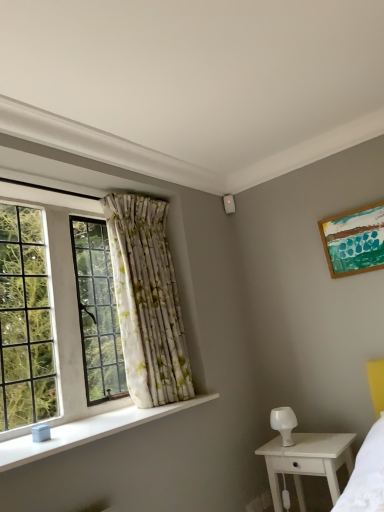
Question: Considering the relative sizes of white wood nightstand at lower right and white smooth window sill at lower left in the image provided, is white wood nightstand at lower right wider than white smooth window sill at lower left?

Choices:
 (A) no
 (B) yes

Answer: (B)

Question: Considering the relative positions of white wood nightstand at lower right and white smooth window sill at lower left in the image provided, is white wood nightstand at lower right behind white smooth window sill at lower left?

Choices:
 (A) yes
 (B) no

Answer: (A)

Question: Is white wood nightstand at lower right not within white smooth window sill at lower left?

Choices:
 (A) yes
 (B) no

Answer: (A)

Question: Does white wood nightstand at lower right have a lesser width compared to white smooth window sill at lower left?

Choices:
 (A) no
 (B) yes

Answer: (A)

Question: Is white wood nightstand at lower right oriented towards white smooth window sill at lower left?

Choices:
 (A) no
 (B) yes

Answer: (A)

Question: Is white glossy lamp at lower right inside the boundaries of white floral fabric curtain at left, or outside?

Choices:
 (A) inside
 (B) outside

Answer: (B)

Question: From a real-world perspective, is white glossy lamp at lower right physically located above or below white floral fabric curtain at left?

Choices:
 (A) below
 (B) above

Answer: (A)

Question: Considering the positions of white glossy lamp at lower right and white floral fabric curtain at left in the image, is white glossy lamp at lower right bigger or smaller than white floral fabric curtain at left?

Choices:
 (A) big
 (B) small

Answer: (B)

Question: In terms of width, does white glossy lamp at lower right look wider or thinner when compared to white floral fabric curtain at left?

Choices:
 (A) thin
 (B) wide

Answer: (A)

Question: From their relative heights in the image, would you say white wood nightstand at lower right is taller or shorter than white smooth window sill at lower left?

Choices:
 (A) short
 (B) tall

Answer: (B)

Question: From a real-world perspective, is white wood nightstand at lower right physically located above or below white smooth window sill at lower left?

Choices:
 (A) above
 (B) below

Answer: (B)

Question: From the image's perspective, is white wood nightstand at lower right above or below white smooth window sill at lower left?

Choices:
 (A) above
 (B) below

Answer: (B)

Question: Is point (339, 444) closer or farther from the camera than point (54, 429)?

Choices:
 (A) closer
 (B) farther

Answer: (B)

Question: Choose the correct answer: Is clear glass window at left inside wooden picture frame at upper right or outside it?

Choices:
 (A) outside
 (B) inside

Answer: (A)

Question: Considering the positions of clear glass window at left and wooden picture frame at upper right in the image, is clear glass window at left taller or shorter than wooden picture frame at upper right?

Choices:
 (A) short
 (B) tall

Answer: (B)